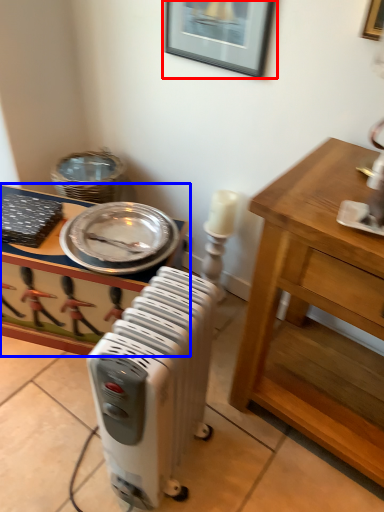
Question: Among these objects, which one is nearest to the camera, picture frame (highlighted by a red box) or desk (highlighted by a blue box)?

Choices:
 (A) picture frame
 (B) desk

Answer: (A)